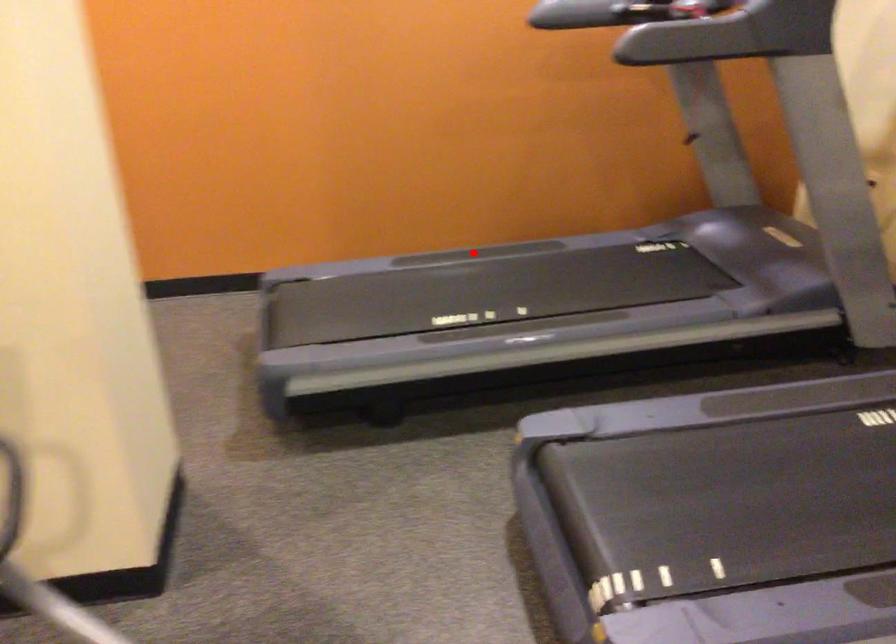
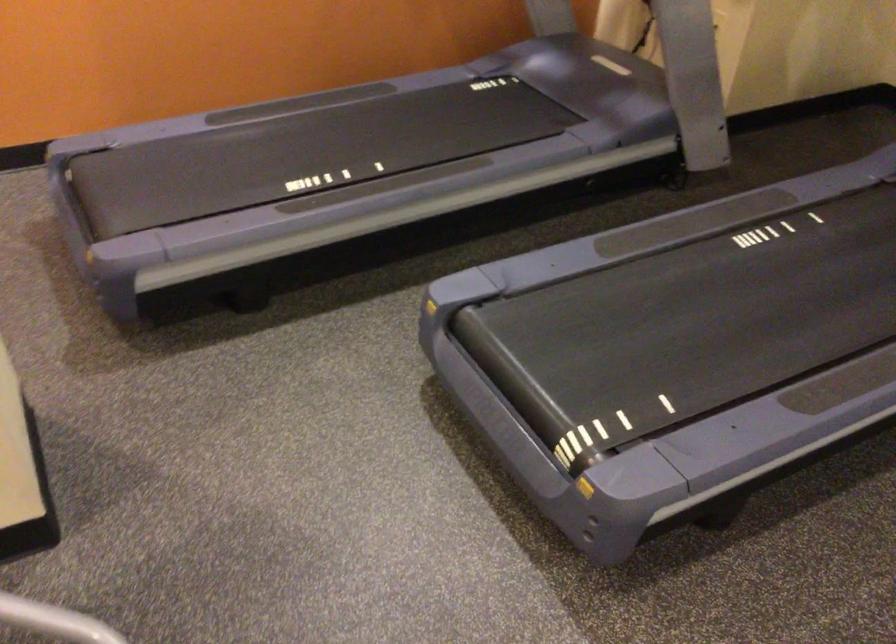
Question: I am providing you with two images of the same scene from different viewpoints. In image1, a red point is highlighted. Considering the same 3D point in image2, which of the following is correct?

Choices:
 (A) It is closer
 (B) It is farther

Answer: (A)